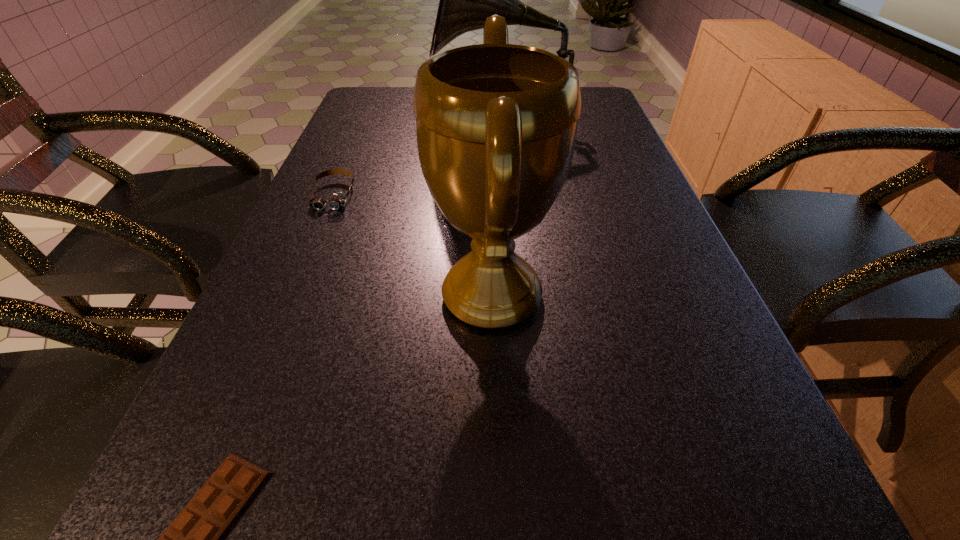
Identify the location of the farthest object. (466, 0).

The width and height of the screenshot is (960, 540). Identify the location of the third farthest object. (496, 123).

Image resolution: width=960 pixels, height=540 pixels. Find the location of `the second tallest object`. the second tallest object is located at coordinates (496, 123).

Find the location of a particular element. the second farthest object is located at coordinates (337, 200).

Image resolution: width=960 pixels, height=540 pixels. What are the coordinates of `the second shortest object` in the screenshot? It's located at (337, 200).

You are a GUI agent. You are given a task and a screenshot of the screen. Output one action in this format:
    pyautogui.click(x=<x>, y=<y>)
    Task: Click on the vacant space situated 0.090m from the horn of the farthest object
    
    Given the screenshot: What is the action you would take?
    pyautogui.click(x=403, y=120)

You are a GUI agent. You are given a task and a screenshot of the screen. Output one action in this format:
    pyautogui.click(x=<x>, y=<y>)
    Task: Click on the free point located from the horn of the farthest object
    
    Given the screenshot: What is the action you would take?
    pyautogui.click(x=383, y=120)

Image resolution: width=960 pixels, height=540 pixels. Identify the location of free point located 0.070m from the horn of the farthest object. [x=411, y=120].

Where is `free space located 0.290m on the front of the third farthest object with the decoration`? free space located 0.290m on the front of the third farthest object with the decoration is located at coordinates (267, 295).

Identify the location of vacant area located on the front of the third farthest object with the decoration. The width and height of the screenshot is (960, 540). (267, 295).